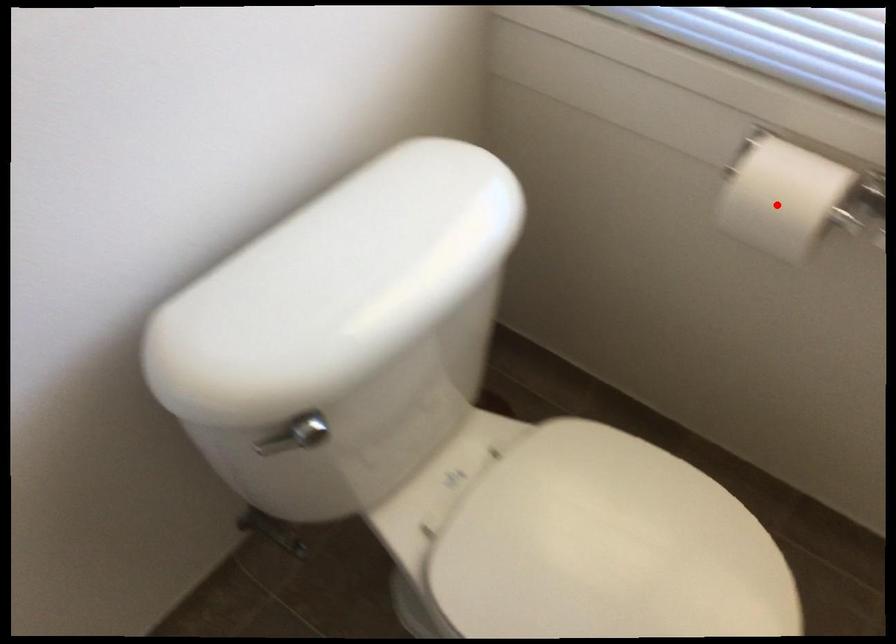
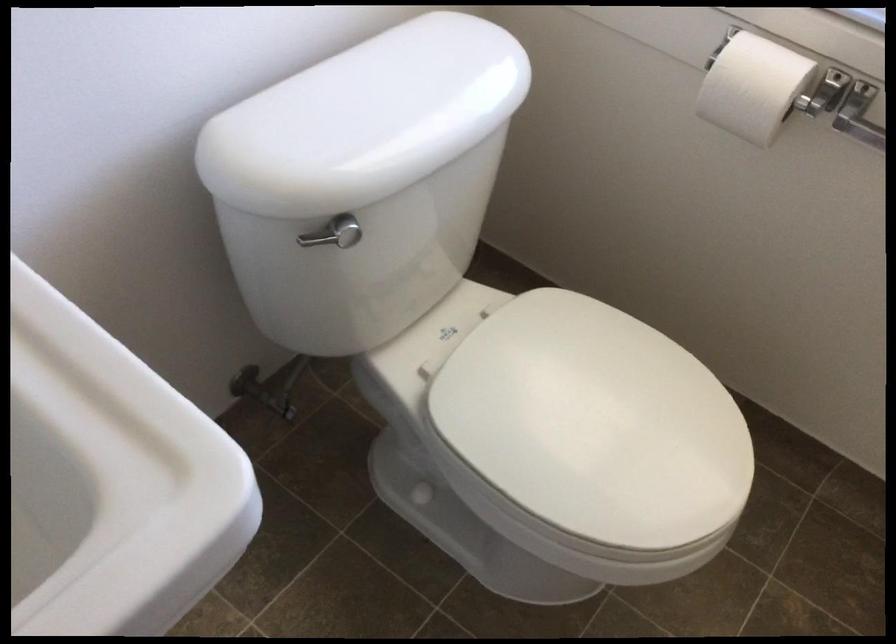
Locate, in the second image, the point that corresponds to the highlighted location in the first image.

(753, 87)